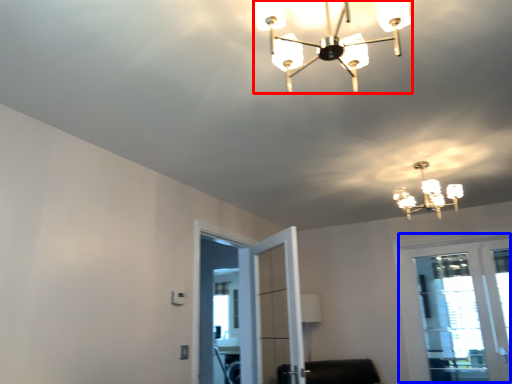
Question: Which of the following is the closest to the observer, lamp (highlighted by a red box) or window (highlighted by a blue box)?

Choices:
 (A) lamp
 (B) window

Answer: (A)